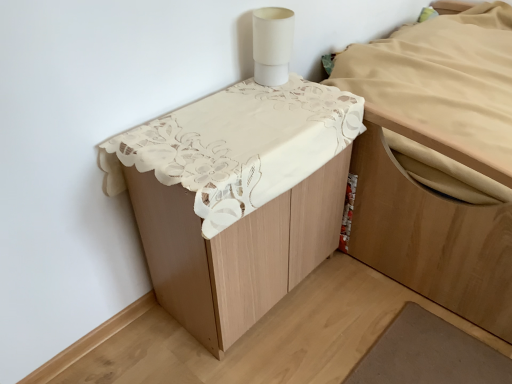
Question: Is white matte cylindrical lamp at upper right aimed at light brown wood bed at upper right, the first furniture when ordered from right to left?

Choices:
 (A) no
 (B) yes

Answer: (A)

Question: Is white matte cylindrical lamp at upper right located outside light brown wood bed at upper right, the first furniture when ordered from right to left?

Choices:
 (A) yes
 (B) no

Answer: (A)

Question: Is white matte cylindrical lamp at upper right to the right of light brown wood bed at upper right, the first furniture when ordered from right to left, from the viewer's perspective?

Choices:
 (A) no
 (B) yes

Answer: (A)

Question: Is white matte cylindrical lamp at upper right smaller than light brown wood bed at upper right, the second furniture from the left?

Choices:
 (A) yes
 (B) no

Answer: (A)

Question: From the image's perspective, is white matte cylindrical lamp at upper right above light brown wood bed at upper right, the second furniture from the left?

Choices:
 (A) yes
 (B) no

Answer: (A)

Question: Is there a large distance between white matte cylindrical lamp at upper right and light brown wood bed at upper right, the second furniture from the left?

Choices:
 (A) yes
 (B) no

Answer: (B)

Question: Is the position of light brown wood bed at upper right, the second furniture from the left, more distant than that of white lace tablecloth at upper center, the 1th furniture from the left?

Choices:
 (A) no
 (B) yes

Answer: (B)

Question: Does light brown wood bed at upper right, the second furniture from the left, have a greater height compared to white lace tablecloth at upper center, acting as the second furniture starting from the right?

Choices:
 (A) no
 (B) yes

Answer: (A)

Question: Is light brown wood bed at upper right, the first furniture when ordered from right to left, directly adjacent to white lace tablecloth at upper center, acting as the second furniture starting from the right?

Choices:
 (A) yes
 (B) no

Answer: (B)

Question: Is light brown wood bed at upper right, the second furniture from the left, oriented away from white lace tablecloth at upper center, the 1th furniture from the left?

Choices:
 (A) no
 (B) yes

Answer: (A)

Question: Is light brown wood bed at upper right, the first furniture when ordered from right to left, not within white lace tablecloth at upper center, acting as the second furniture starting from the right?

Choices:
 (A) no
 (B) yes

Answer: (B)

Question: Is light brown wood bed at upper right, the second furniture from the left, closer to camera compared to white lace tablecloth at upper center, acting as the second furniture starting from the right?

Choices:
 (A) no
 (B) yes

Answer: (A)

Question: Does white matte cylindrical lamp at upper right have a lesser width compared to white lace tablecloth at upper center, acting as the second furniture starting from the right?

Choices:
 (A) yes
 (B) no

Answer: (A)